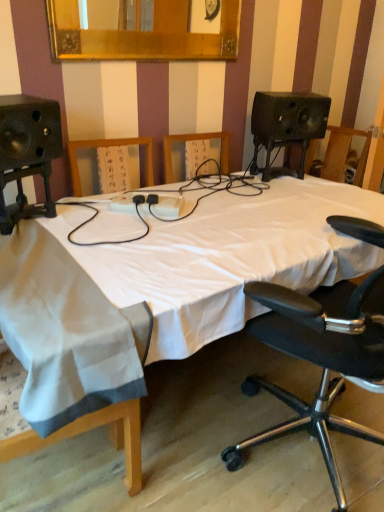
Question: Can you confirm if black leather office chair at right is smaller than white cloth at left?

Choices:
 (A) no
 (B) yes

Answer: (A)

Question: Does black leather office chair at right have a lesser width compared to white cloth at left?

Choices:
 (A) yes
 (B) no

Answer: (B)

Question: From the image's perspective, would you say black leather office chair at right is shown under white cloth at left?

Choices:
 (A) yes
 (B) no

Answer: (B)

Question: Is black leather office chair at right positioned behind white cloth at left?

Choices:
 (A) no
 (B) yes

Answer: (A)

Question: Are black leather office chair at right and white cloth at left making contact?

Choices:
 (A) yes
 (B) no

Answer: (B)

Question: Would you say gold-framed mirror at upper center is inside or outside white fabric bed at center?

Choices:
 (A) outside
 (B) inside

Answer: (A)

Question: In terms of size, does gold-framed mirror at upper center appear bigger or smaller than white fabric bed at center?

Choices:
 (A) big
 (B) small

Answer: (B)

Question: From a real-world perspective, is gold-framed mirror at upper center positioned above or below white fabric bed at center?

Choices:
 (A) below
 (B) above

Answer: (B)

Question: In terms of width, does gold-framed mirror at upper center look wider or thinner when compared to white fabric bed at center?

Choices:
 (A) thin
 (B) wide

Answer: (A)

Question: Is white fabric bed at center bigger or smaller than gold-framed mirror at upper center?

Choices:
 (A) small
 (B) big

Answer: (B)

Question: From a real-world perspective, relative to gold-framed mirror at upper center, is white fabric bed at center vertically above or below?

Choices:
 (A) above
 (B) below

Answer: (B)

Question: Considering the positions of white fabric bed at center and gold-framed mirror at upper center in the image, is white fabric bed at center wider or thinner than gold-framed mirror at upper center?

Choices:
 (A) wide
 (B) thin

Answer: (A)

Question: Visually, is white fabric bed at center positioned to the left or to the right of gold-framed mirror at upper center?

Choices:
 (A) right
 (B) left

Answer: (A)

Question: Considering the positions of gold-framed mirror at upper center and black leather office chair at right in the image, is gold-framed mirror at upper center wider or thinner than black leather office chair at right?

Choices:
 (A) thin
 (B) wide

Answer: (A)

Question: In the image, is gold-framed mirror at upper center positioned in front of or behind black leather office chair at right?

Choices:
 (A) front
 (B) behind

Answer: (B)